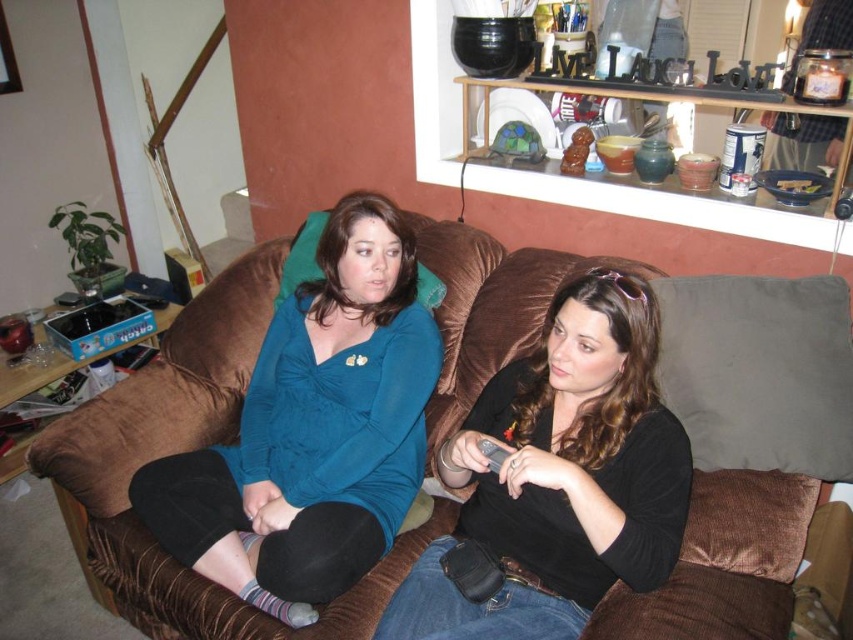
Question: Based on their relative distances, which object is nearer to the black plastic remote at center?

Choices:
 (A) teal fabric shirt at center
 (B) black matte shirt at center

Answer: (B)

Question: Which of these objects is positioned closest to the teal fabric shirt at center?

Choices:
 (A) black plastic remote at center
 (B) brown corduroy couch at center
 (C) black matte shirt at center

Answer: (B)

Question: Is brown corduroy couch at center wider than black matte shirt at center?

Choices:
 (A) no
 (B) yes

Answer: (B)

Question: Does brown corduroy couch at center come in front of black matte shirt at center?

Choices:
 (A) no
 (B) yes

Answer: (A)

Question: Considering the real-world distances, which object is closest to the brown corduroy couch at center?

Choices:
 (A) black plastic remote at center
 (B) black matte shirt at center

Answer: (B)

Question: Does teal fabric shirt at center appear over black plastic remote at center?

Choices:
 (A) no
 (B) yes

Answer: (B)